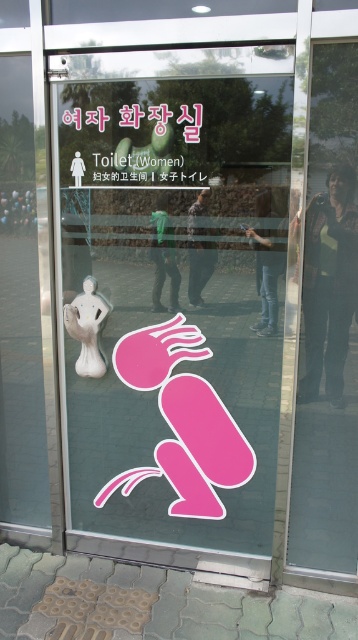
Question: From the image, what is the correct spatial relationship of transparent glass door at right in relation to white glossy statue at center?

Choices:
 (A) right
 (B) left

Answer: (A)

Question: Does transparent glass door at right have a lesser width compared to white glossy statue at center?

Choices:
 (A) no
 (B) yes

Answer: (A)

Question: Does transparent glass door at right lie behind white glossy statue at center?

Choices:
 (A) no
 (B) yes

Answer: (A)

Question: Among these objects, which one is nearest to the camera?

Choices:
 (A) transparent glass door at right
 (B) white glossy statue at center

Answer: (A)